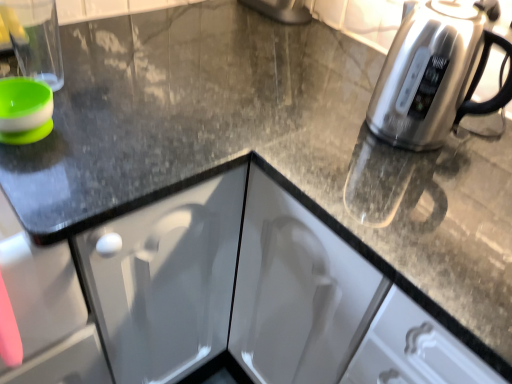
Question: Based on their sizes in the image, would you say satin silver kettle at right is bigger or smaller than transparent plastic cup at upper left?

Choices:
 (A) small
 (B) big

Answer: (B)

Question: Is point (400, 79) closer or farther from the camera than point (54, 8)?

Choices:
 (A) closer
 (B) farther

Answer: (A)

Question: Would you say satin silver kettle at right is inside or outside transparent plastic cup at upper left?

Choices:
 (A) outside
 (B) inside

Answer: (A)

Question: Considering the positions of point (18, 34) and point (432, 119), is point (18, 34) closer or farther from the camera than point (432, 119)?

Choices:
 (A) farther
 (B) closer

Answer: (A)

Question: Would you say transparent plastic cup at upper left is to the left or to the right of satin silver kettle at right in the picture?

Choices:
 (A) right
 (B) left

Answer: (B)

Question: Is transparent plastic cup at upper left wider or thinner than satin silver kettle at right?

Choices:
 (A) wide
 (B) thin

Answer: (B)

Question: Is transparent plastic cup at upper left inside or outside of satin silver kettle at right?

Choices:
 (A) inside
 (B) outside

Answer: (B)